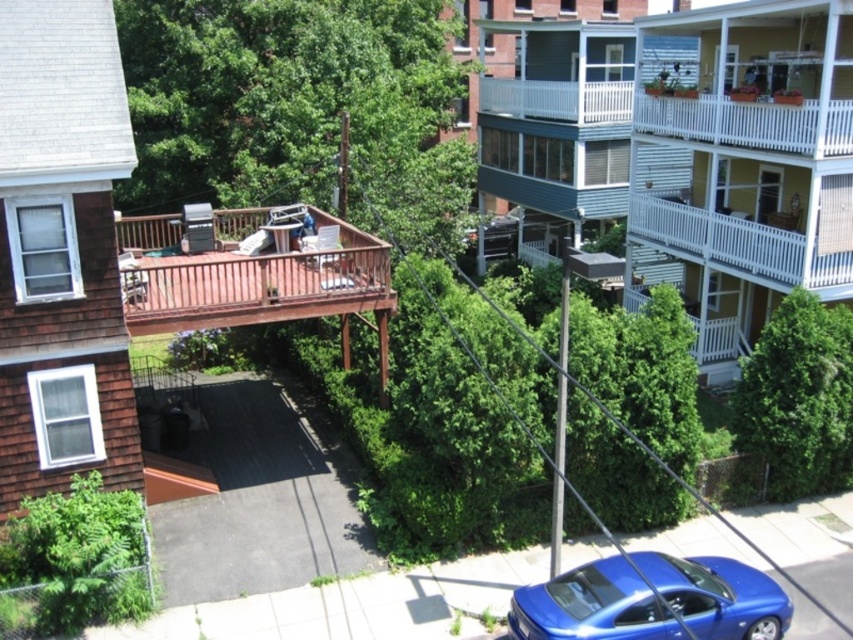
Based on the photo, which of these two, green leafy tree at center or shiny blue car at lower right, stands shorter?

shiny blue car at lower right is shorter.

Which is more to the right, green leafy tree at center or shiny blue car at lower right?

shiny blue car at lower right is more to the right.

Is point (457, 225) positioned before point (554, 580)?

No, it is behind (554, 580).

This screenshot has width=853, height=640. In order to click on green leafy tree at center in this screenshot , I will do `click(294, 104)`.

Does green leafy tree at center come behind smooth concrete deck at center?

Yes, it is behind smooth concrete deck at center.

Is the position of green leafy tree at center less distant than that of smooth concrete deck at center?

No, green leafy tree at center is behind smooth concrete deck at center.

Locate an element on the screen. green leafy tree at center is located at coordinates (294, 104).

Can you confirm if smooth concrete deck at center is positioned below green leafy tree at center-right?

Indeed, smooth concrete deck at center is positioned under green leafy tree at center-right.

Can you confirm if smooth concrete deck at center is wider than green leafy tree at center-right?

Yes.

Identify the location of smooth concrete deck at center. (258, 497).